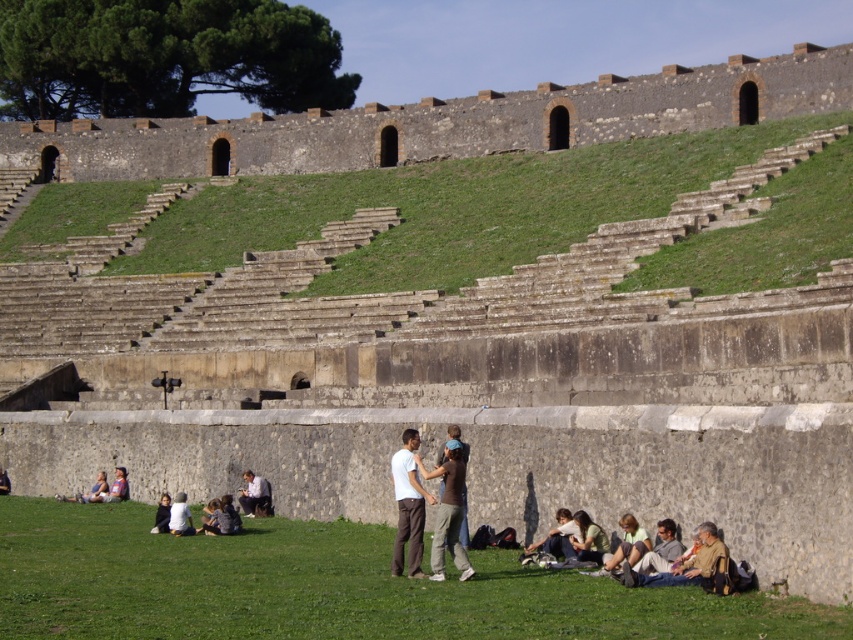
Question: Is green grass at lower center smaller than light brown leather jacket at lower center?

Choices:
 (A) no
 (B) yes

Answer: (A)

Question: Which point is closer to the camera?

Choices:
 (A) (595, 554)
 (B) (178, 502)

Answer: (A)

Question: Is brown cotton shirt at center positioned at the back of light brown fabric child at lower left?

Choices:
 (A) no
 (B) yes

Answer: (A)

Question: Which point is farther from the camera taking this photo?

Choices:
 (A) (596, 557)
 (B) (112, 588)
 (C) (115, 490)

Answer: (C)

Question: Which point is closer to the camera?

Choices:
 (A) white fabric at lower left
 (B) brown cotton shirt at center
 (C) white cotton shirt at center

Answer: (B)

Question: From the image, what is the correct spatial relationship of green fabric jacket at lower center in relation to light brown fabric child at lower left?

Choices:
 (A) above
 (B) below

Answer: (A)